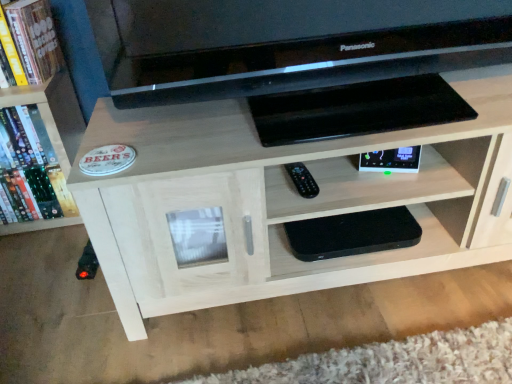
Question: Considering the relative sizes of light wood shelf at center, acting as the 2th shelf starting from the bottom, and black matte speaker at lower center, the 2th shelf in the top-to-bottom sequence, in the image provided, is light wood shelf at center, acting as the 2th shelf starting from the bottom, wider than black matte speaker at lower center, the 2th shelf in the top-to-bottom sequence,?

Choices:
 (A) yes
 (B) no

Answer: (A)

Question: Is light wood shelf at center, the 1th shelf viewed from the top, turned away from black matte speaker at lower center, which is the first shelf from bottom to top?

Choices:
 (A) no
 (B) yes

Answer: (B)

Question: Is light wood shelf at center, acting as the 2th shelf starting from the bottom, beside black matte speaker at lower center, which is the first shelf from bottom to top?

Choices:
 (A) yes
 (B) no

Answer: (B)

Question: Does light wood shelf at center, the 1th shelf viewed from the top, lie behind black matte speaker at lower center, the 2th shelf in the top-to-bottom sequence?

Choices:
 (A) yes
 (B) no

Answer: (B)

Question: Is light wood shelf at center, acting as the 2th shelf starting from the bottom, aimed at black matte speaker at lower center, the 2th shelf in the top-to-bottom sequence?

Choices:
 (A) no
 (B) yes

Answer: (B)

Question: From a real-world perspective, does light wood shelf at center, acting as the 2th shelf starting from the bottom, sit lower than black matte speaker at lower center, the 2th shelf in the top-to-bottom sequence?

Choices:
 (A) no
 (B) yes

Answer: (A)

Question: From the image's perspective, does black glossy tv at upper center appear higher than wooden bookshelf at left?

Choices:
 (A) no
 (B) yes

Answer: (B)

Question: Does black glossy tv at upper center have a lesser width compared to wooden bookshelf at left?

Choices:
 (A) yes
 (B) no

Answer: (A)

Question: Does black glossy tv at upper center have a greater width compared to wooden bookshelf at left?

Choices:
 (A) yes
 (B) no

Answer: (B)

Question: Is black glossy tv at upper center to the right of wooden bookshelf at left from the viewer's perspective?

Choices:
 (A) no
 (B) yes

Answer: (B)

Question: Is black glossy tv at upper center touching wooden bookshelf at left?

Choices:
 (A) no
 (B) yes

Answer: (A)

Question: Considering the relative sizes of black glossy tv at upper center and wooden bookshelf at left in the image provided, is black glossy tv at upper center bigger than wooden bookshelf at left?

Choices:
 (A) yes
 (B) no

Answer: (A)

Question: Is the surface of black plastic remote at center in direct contact with wooden bookshelf at left?

Choices:
 (A) no
 (B) yes

Answer: (A)